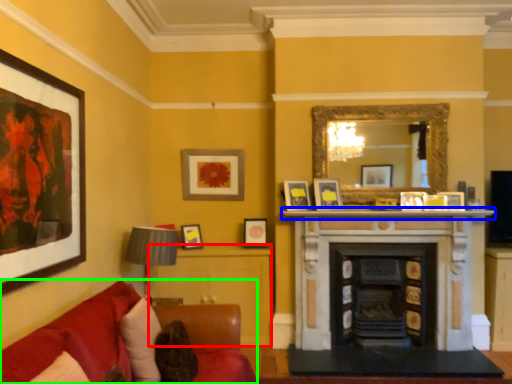
Question: Which object is the farthest from table (highlighted by a red box)? Choose among these: mantle (highlighted by a blue box) or studio couch (highlighted by a green box).

Choices:
 (A) mantle
 (B) studio couch

Answer: (B)